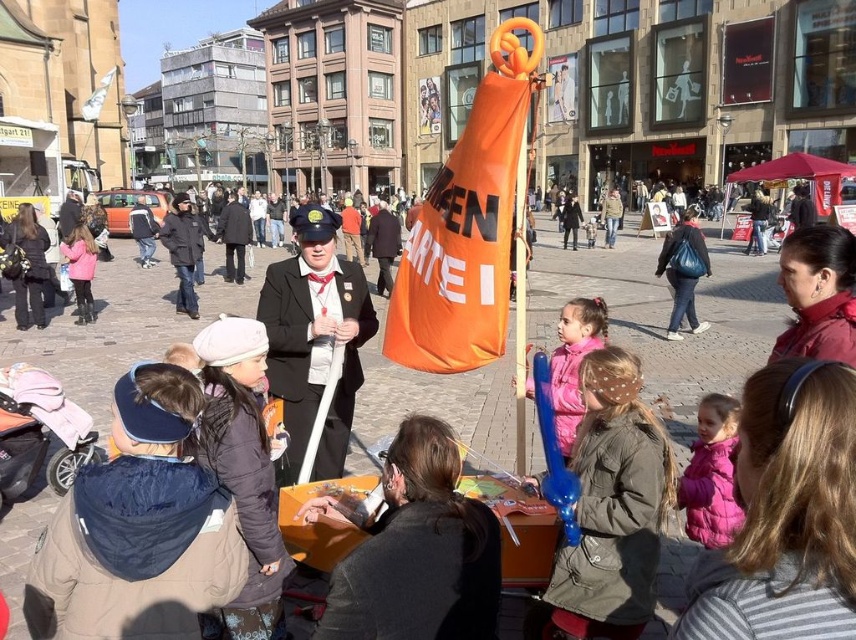
Question: Which object is closer to the camera taking this photo?

Choices:
 (A) matte blue balloon at center
 (B) pink matte jacket at center

Answer: (A)

Question: Which point is farther to the camera?

Choices:
 (A) dark gray puffer jacket at lower left
 (B) pink puffer jacket at lower right
 (C) black fabric coat at center

Answer: (C)

Question: Does orange fabric banner at center have a lesser width compared to black fabric coat at center?

Choices:
 (A) yes
 (B) no

Answer: (A)

Question: Is orange fabric banner at center behind black fabric coat at center?

Choices:
 (A) yes
 (B) no

Answer: (B)

Question: Which is nearer to the pink puffer jacket at lower right?

Choices:
 (A) matte blue balloon at center
 (B) black fabric coat at center
 (C) matte black uniform at center
 (D) orange fabric banner at center

Answer: (A)

Question: Can you confirm if matte blue balloon at center is positioned to the right of pink matte jacket at center?

Choices:
 (A) no
 (B) yes

Answer: (A)